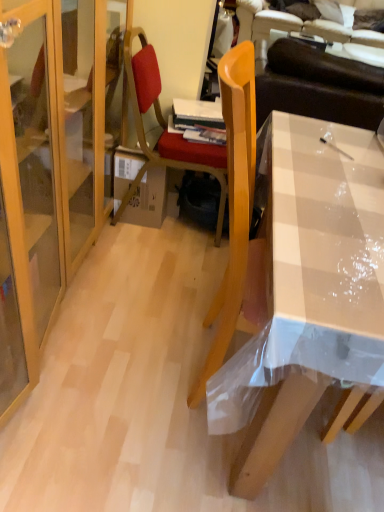
What is the approximate height of brown leather couch at upper right?

It is 34.73 inches.

You are a GUI agent. You are given a task and a screenshot of the screen. Output one action in this format:
    pyautogui.click(x=<x>, y=<y>)
    Task: Click on the wooden chair at center
    This screenshot has width=384, height=512.
    Given the screenshot: What is the action you would take?
    pyautogui.click(x=165, y=129)

Describe the element at coordinates (165, 129) in the screenshot. The height and width of the screenshot is (512, 384). I see `wooden chair at center` at that location.

This screenshot has width=384, height=512. In order to click on brown leather couch at upper right in this screenshot , I will do `click(293, 29)`.

Measure the distance between cardboard box at center and clear plastic desk at center.

cardboard box at center is 38.11 inches away from clear plastic desk at center.

From a real-world perspective, is cardboard box at center physically above clear plastic desk at center?

No, from a real-world perspective, cardboard box at center is not above clear plastic desk at center.

Does cardboard box at center contain clear plastic desk at center?

No, clear plastic desk at center is not a part of cardboard box at center.

Does point (143, 210) appear closer or farther from the camera than point (296, 234)?

Clearly, point (143, 210) is more distant from the camera than point (296, 234).

Is cardboard box at center looking in the opposite direction of wooden chair at center?

Yes, cardboard box at center's orientation is away from wooden chair at center.

Considering the relative positions of cardboard box at center and wooden chair at center in the image provided, is cardboard box at center to the left or to the right of wooden chair at center?

cardboard box at center is to the left of wooden chair at center.

From a real-world perspective, which object stands above the other?

From a 3D spatial view, wooden chair at center is above.

Which object is closer to the camera, brown leather couch at upper right or wooden chair at center?

Positioned in front is wooden chair at center.

Could wooden chair at center be considered to be inside brown leather couch at upper right?

No, wooden chair at center is not inside brown leather couch at upper right.

Based on the photo, who is taller, clear plastic desk at center or cardboard box at center?

Standing taller between the two is clear plastic desk at center.

Is clear plastic desk at center not near cardboard box at center?

Actually, clear plastic desk at center and cardboard box at center are a little close together.

Does clear plastic desk at center come behind cardboard box at center?

No, it is not.

Considering the positions of objects clear plastic desk at center and cardboard box at center in the image provided, who is more to the left, clear plastic desk at center or cardboard box at center?

Positioned to the left is cardboard box at center.

Does brown leather couch at upper right appear on the right side of cardboard box at center?

Correct, you'll find brown leather couch at upper right to the right of cardboard box at center.

From a real-world perspective, which is physically above, brown leather couch at upper right or cardboard box at center?

brown leather couch at upper right is physically above.

Which object is wider, brown leather couch at upper right or cardboard box at center?

Wider between the two is brown leather couch at upper right.

Is there a large distance between brown leather couch at upper right and cardboard box at center?

No.

Can you confirm if wooden chair at center is positioned to the right of clear plastic desk at center?

No.

Based on the photo, relative to clear plastic desk at center, is wooden chair at center in front or behind?

Clearly, wooden chair at center is behind clear plastic desk at center.

Measure the distance between wooden chair at center and clear plastic desk at center.

A distance of 30.90 inches exists between wooden chair at center and clear plastic desk at center.

Identify the location of box below the wooden chair at center (from the image's perspective). The image size is (384, 512). point(148,200).

Based on the photo, considering the sizes of objects wooden chair at center and cardboard box at center in the image provided, who is shorter, wooden chair at center or cardboard box at center?

cardboard box at center is shorter.

Considering the sizes of objects wooden chair at center and cardboard box at center in the image provided, who is bigger, wooden chair at center or cardboard box at center?

wooden chair at center.

From a real-world perspective, between wooden chair at center and cardboard box at center, who is vertically higher?

From a 3D spatial view, wooden chair at center is above.

Locate an element on the screen. The height and width of the screenshot is (512, 384). desk below the cardboard box at center (from the image's perspective) is located at coordinates (325, 228).

Image resolution: width=384 pixels, height=512 pixels. I want to click on chair lying on the right of cardboard box at center, so click(165, 129).

Looking at the image, which one is located further to wooden chair at center, cardboard box at center or clear plastic desk at center?

clear plastic desk at center lies further to wooden chair at center than the other object.

Looking at this image, considering their positions, is clear plastic desk at center positioned closer to cardboard box at center than wooden chair at center?

Among the two, wooden chair at center is located nearer to cardboard box at center.

From the image, which object appears to be farther from cardboard box at center, wooden chair at center or brown leather couch at upper right?

The object further to cardboard box at center is brown leather couch at upper right.

When comparing their distances from cardboard box at center, does wooden chair at center or clear plastic desk at center seem closer?

wooden chair at center lies closer to cardboard box at center than the other object.

Considering their positions, is brown leather couch at upper right positioned closer to cardboard box at center than wooden chair at center?

wooden chair at center is closer to cardboard box at center.

Based on the photo, based on their spatial positions, is brown leather couch at upper right or clear plastic desk at center further from wooden chair at center?

Based on the image, clear plastic desk at center appears to be further to wooden chair at center.

From the image, which object appears to be farther from clear plastic desk at center, wooden chair at center or cardboard box at center?

cardboard box at center.

Looking at the image, which one is located closer to cardboard box at center, clear plastic desk at center or brown leather couch at upper right?

brown leather couch at upper right lies closer to cardboard box at center than the other object.

I want to click on box between clear plastic desk at center and brown leather couch at upper right along the z-axis, so click(148, 200).

This screenshot has width=384, height=512. Find the location of `chair between clear plastic desk at center and cardboard box at center from front to back`. chair between clear plastic desk at center and cardboard box at center from front to back is located at coordinates (165, 129).

This screenshot has height=512, width=384. What are the coordinates of `box between wooden chair at center and brown leather couch at upper right along the z-axis` in the screenshot? It's located at (148, 200).

Where is `chair located between clear plastic desk at center and brown leather couch at upper right in the depth direction`? The height and width of the screenshot is (512, 384). chair located between clear plastic desk at center and brown leather couch at upper right in the depth direction is located at coordinates (165, 129).